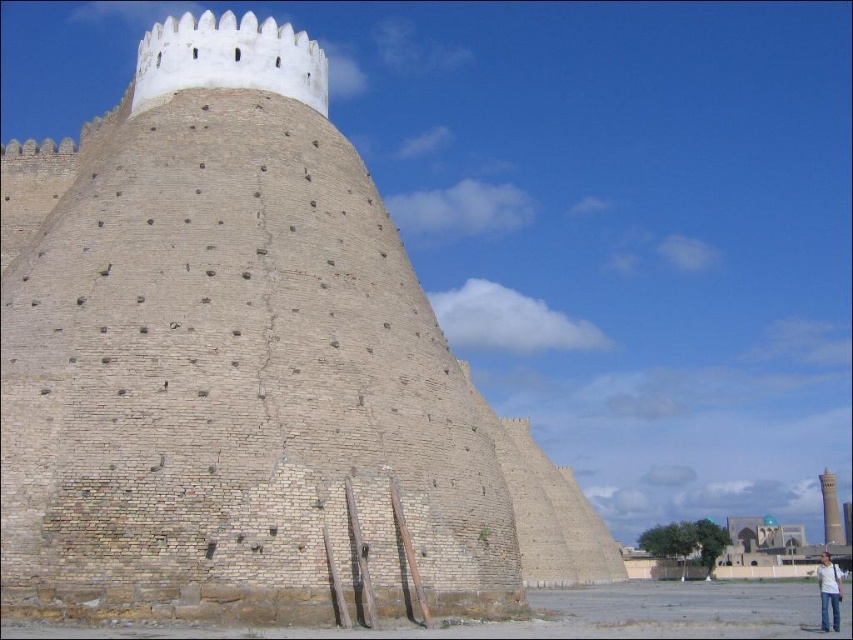
You are standing at the point marked as point (x=247, y=371) in the image. Based on the scene description, what structure are you facing?

The point (x=247, y=371) corresponds to the beige brick fort at center, so you are facing the beige brick fort at center.

You are an architect examining the ancient fortress. You need to determine which structure has a greater horizontal span when viewed from above. Which one is wider between the beige brick fort at center and the smooth beige tower at right?

The beige brick fort at center has a greater horizontal span than the smooth beige tower at right, as its width is larger according to the description.

You are an architect examining the ancient fortress. From your vantage point, you notice the beige brick fort at center and the smooth beige tower at right. Which structure would cast a longer shadow during midday? Please explain your reasoning based on their relative heights.

The beige brick fort at center is much taller than the smooth beige tower at right. Since taller structures cast longer shadows under the same lighting conditions, the beige brick fort at center would cast a longer shadow during midday.